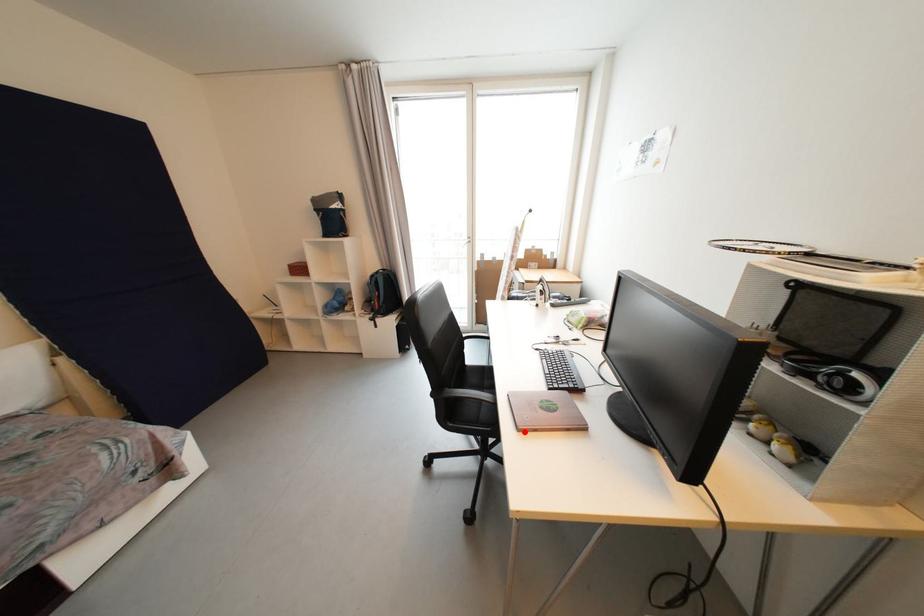
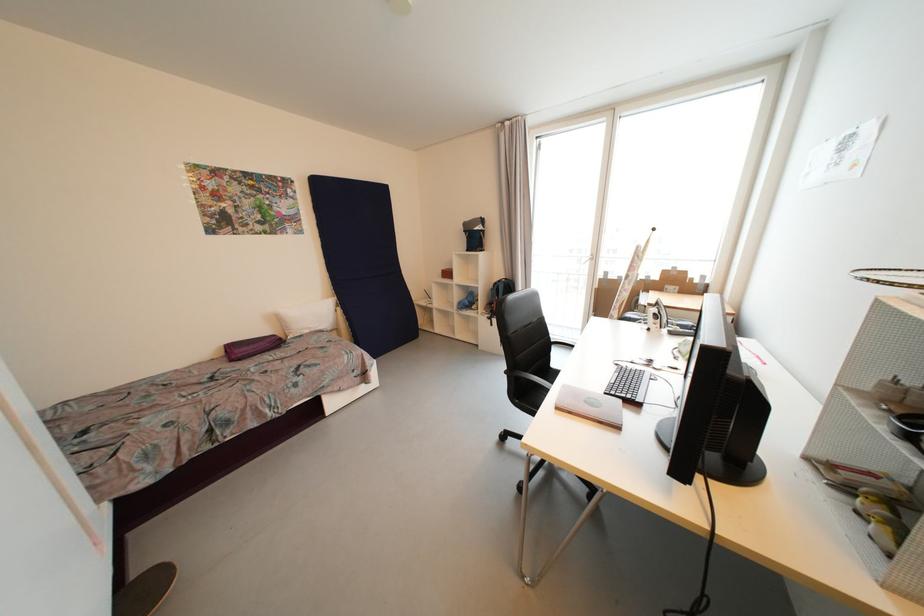
Locate, in the second image, the point that corresponds to the highlighted location in the first image.

(562, 410)